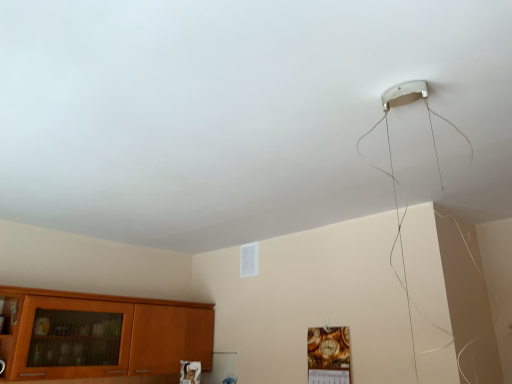
What do you see at coordinates (100, 335) in the screenshot?
I see `wooden cabinet at lower left` at bounding box center [100, 335].

From the picture: What is the approximate width of wooden cabinet at lower left?

It is 17.18 inches.

The width and height of the screenshot is (512, 384). Find the location of `wooden cabinet at lower left`. wooden cabinet at lower left is located at coordinates (100, 335).

Locate an element on the screen. wooden cabinet at lower left is located at coordinates (100, 335).